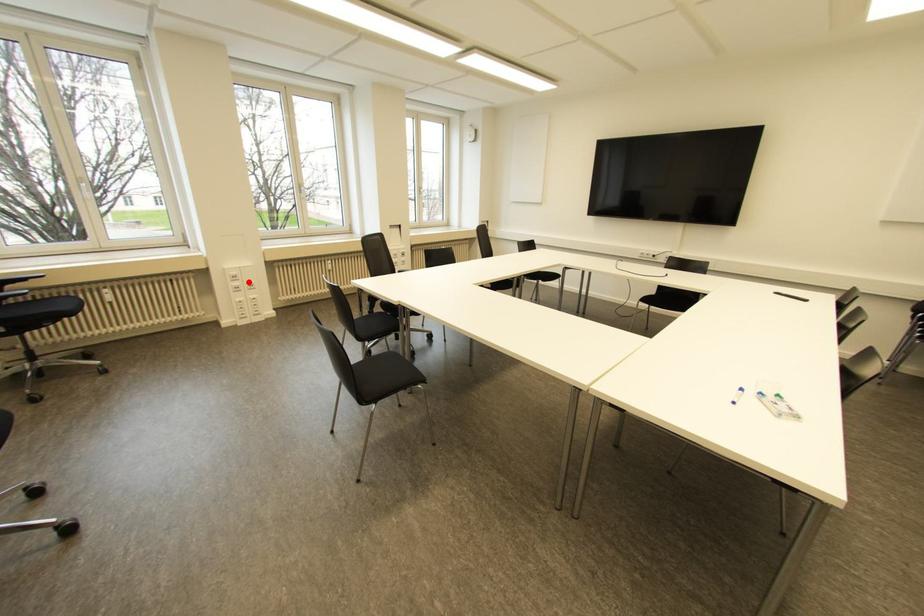
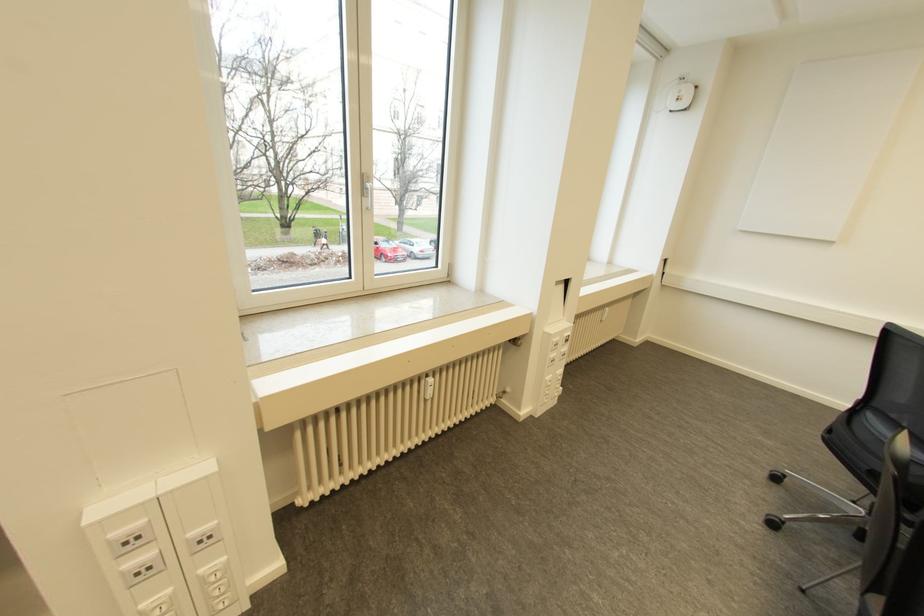
Question: I am providing you with two images of the same scene from different viewpoints. Image1 has a red point marked. In image2, the corresponding 3D location appears at what relative position? Reply with the corresponding letter.

Choices:
 (A) Closer
 (B) Farther

Answer: (B)